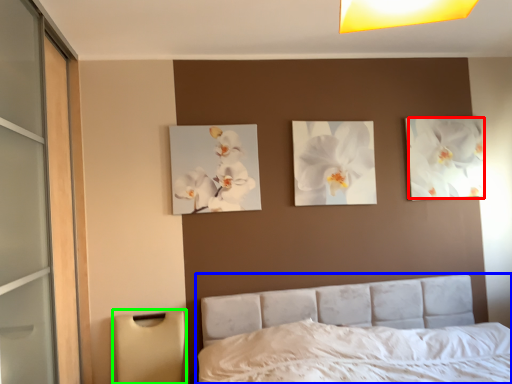
Question: Which object is positioned farthest from flower (highlighted by a red box)? Select from bed (highlighted by a blue box) and lamp (highlighted by a green box).

Choices:
 (A) bed
 (B) lamp

Answer: (B)